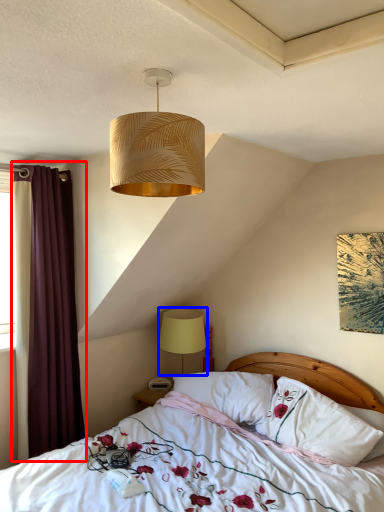
Question: Which point is closer to the camera, curtain (highlighted by a red box) or lamp (highlighted by a blue box)?

Choices:
 (A) curtain
 (B) lamp

Answer: (A)